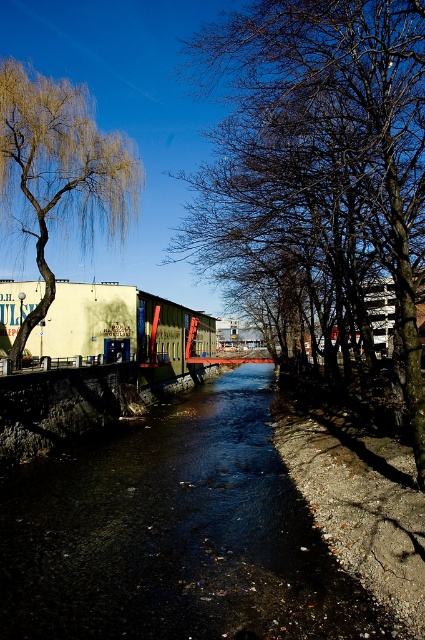
Question: Which object is positioned farthest from the black smooth water at center?

Choices:
 (A) golden textured willow at upper left
 (B) bare branches at center

Answer: (B)

Question: Where is bare branches at center located in relation to golden textured willow at upper left in the image?

Choices:
 (A) right
 (B) left

Answer: (A)

Question: Considering the real-world distances, which object is farthest from the bare branches at center?

Choices:
 (A) black smooth water at center
 (B) golden textured willow at upper left

Answer: (A)

Question: Is black smooth water at center below golden textured willow at upper left?

Choices:
 (A) no
 (B) yes

Answer: (B)

Question: Based on their relative distances, which object is nearer to the bare branches at center?

Choices:
 (A) black smooth water at center
 (B) golden textured willow at upper left

Answer: (B)

Question: Is bare branches at center wider than golden textured willow at upper left?

Choices:
 (A) yes
 (B) no

Answer: (B)